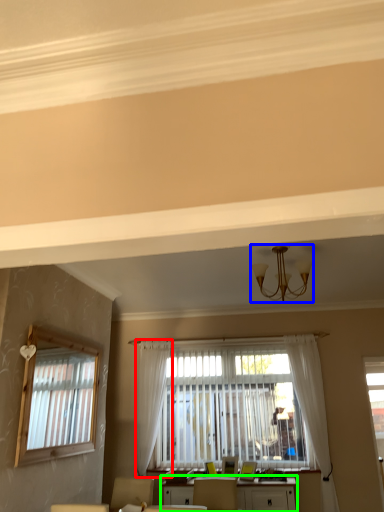
Question: Which object is positioned farthest from curtain (highlighted by a red box)? Select from light fixture (highlighted by a blue box) and table (highlighted by a green box).

Choices:
 (A) light fixture
 (B) table

Answer: (A)